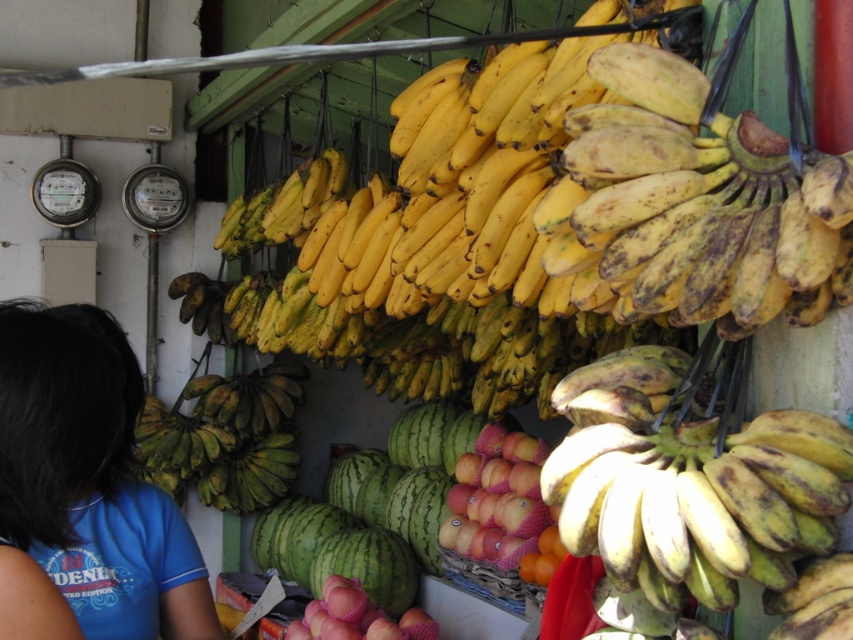
Question: Which of the following is the closest to the observer?

Choices:
 (A) (114, 602)
 (B) (693, 547)
 (C) (732, 186)

Answer: (B)

Question: Which point appears closest to the camera in this image?

Choices:
 (A) (67, 353)
 (B) (821, 198)
 (C) (779, 486)

Answer: (B)

Question: Which of the following is the closest to the observer?

Choices:
 (A) (786, 189)
 (B) (155, 525)

Answer: (A)

Question: Can you confirm if blue fabric shirt at lower left is thinner than yellow matte bananas at center?

Choices:
 (A) no
 (B) yes

Answer: (B)

Question: In this image, where is ripe yellow bananas at center located relative to blue fabric shirt at lower left?

Choices:
 (A) above
 (B) below

Answer: (A)

Question: Is blue fabric shirt at lower left bigger than yellow matte bananas at center?

Choices:
 (A) yes
 (B) no

Answer: (A)